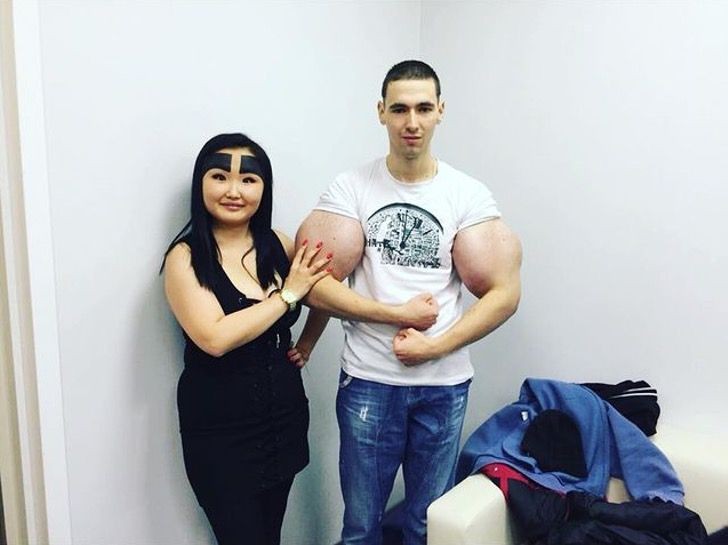
The width and height of the screenshot is (728, 545). I want to click on walls, so click(121, 96), click(630, 127).